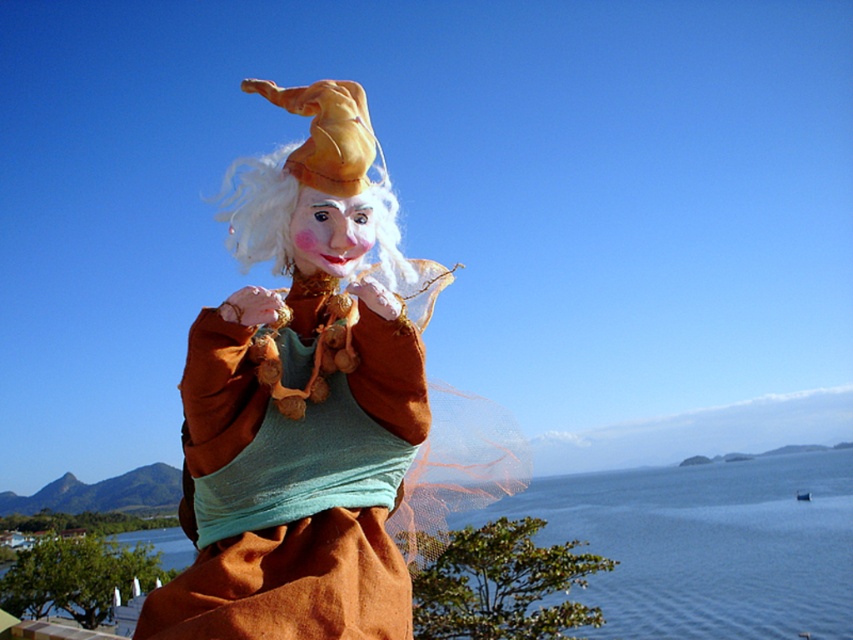
Question: Which object is closer to the camera taking this photo?

Choices:
 (A) blue water at center
 (B) white fabric wig at center

Answer: (B)

Question: Is matte brown doll at center smaller than white fabric wig at center?

Choices:
 (A) yes
 (B) no

Answer: (A)

Question: Does matte brown doll at center appear on the right side of blue water at center?

Choices:
 (A) no
 (B) yes

Answer: (A)

Question: Does matte brown doll at center come behind blue water at center?

Choices:
 (A) yes
 (B) no

Answer: (B)

Question: Which object is the farthest from the blue water at center?

Choices:
 (A) white fabric wig at center
 (B) matte brown doll at center

Answer: (A)

Question: Which point appears closest to the camera in this image?

Choices:
 (A) [x=260, y=355]
 (B) [x=770, y=536]
 (C) [x=401, y=273]

Answer: (A)